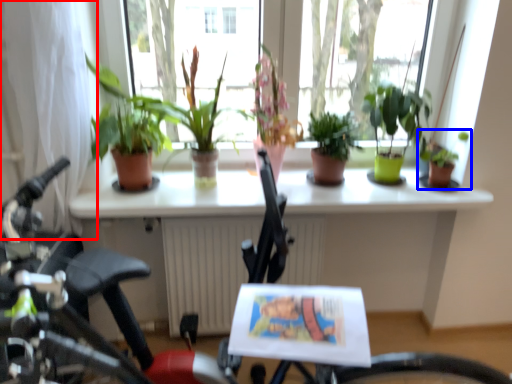
Question: Which point is further to the camera, curtain (highlighted by a red box) or houseplant (highlighted by a blue box)?

Choices:
 (A) curtain
 (B) houseplant

Answer: (B)